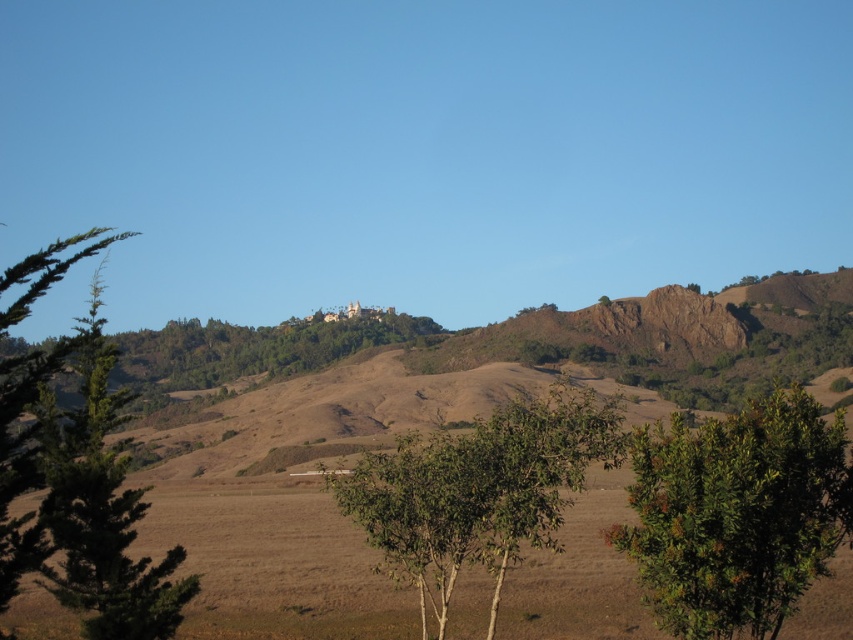
Question: Is green leafy tree at center bigger than green leafy tree at left?

Choices:
 (A) yes
 (B) no

Answer: (B)

Question: Which object is closer to the camera taking this photo?

Choices:
 (A) green leafy tree at lower right
 (B) green leafy tree at center
 (C) green leafy tree at left
 (D) brown grassy hillside at center

Answer: (C)

Question: Which object appears farthest from the camera in this image?

Choices:
 (A) green leafy tree at left
 (B) green leafy tree at center

Answer: (B)

Question: Which of the following is the closest to the observer?

Choices:
 (A) (712, 312)
 (B) (672, 529)
 (C) (540, 474)
 (D) (61, 484)

Answer: (D)

Question: Observing the image, what is the correct spatial positioning of green leafy tree at lower right in reference to green leafy tree at left?

Choices:
 (A) above
 (B) below

Answer: (B)

Question: Is green leafy tree at lower right thinner than green leafy tree at left?

Choices:
 (A) yes
 (B) no

Answer: (A)